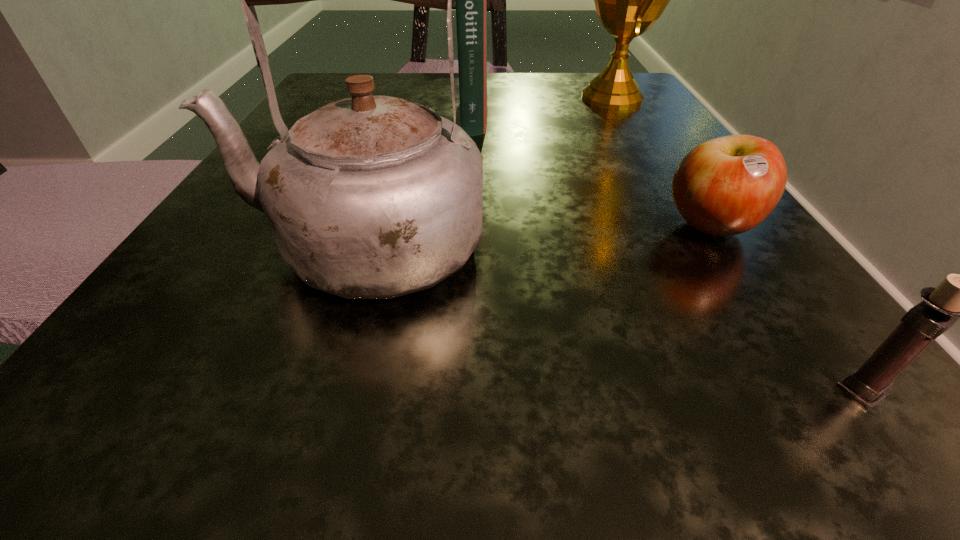
The image size is (960, 540). In order to click on award in this screenshot , I will do `click(629, 0)`.

Locate an element on the screen. This screenshot has width=960, height=540. hardback book is located at coordinates (471, 10).

What are the coordinates of `kettle` in the screenshot? It's located at (x=371, y=197).

The width and height of the screenshot is (960, 540). Identify the location of the nearest object. (957, 297).

At what (x,y) coordinates should I click in order to perform the action: click on apple. Please return your answer as a coordinate pair (x, y). This screenshot has height=540, width=960. Looking at the image, I should click on (725, 186).

Find the location of a particular element. This screenshot has height=540, width=960. vacant region located on the front-facing side of the award is located at coordinates (511, 98).

Find the location of `free space located on the front-facing side of the award`. free space located on the front-facing side of the award is located at coordinates (490, 98).

This screenshot has width=960, height=540. I want to click on free space located on the front-facing side of the award, so click(548, 98).

The width and height of the screenshot is (960, 540). In order to click on vacant space situated on the cover of the hardback book in this screenshot , I will do click(562, 113).

The height and width of the screenshot is (540, 960). In order to click on vacant area located 0.050m at the spout of the kettle in this screenshot , I will do `click(200, 245)`.